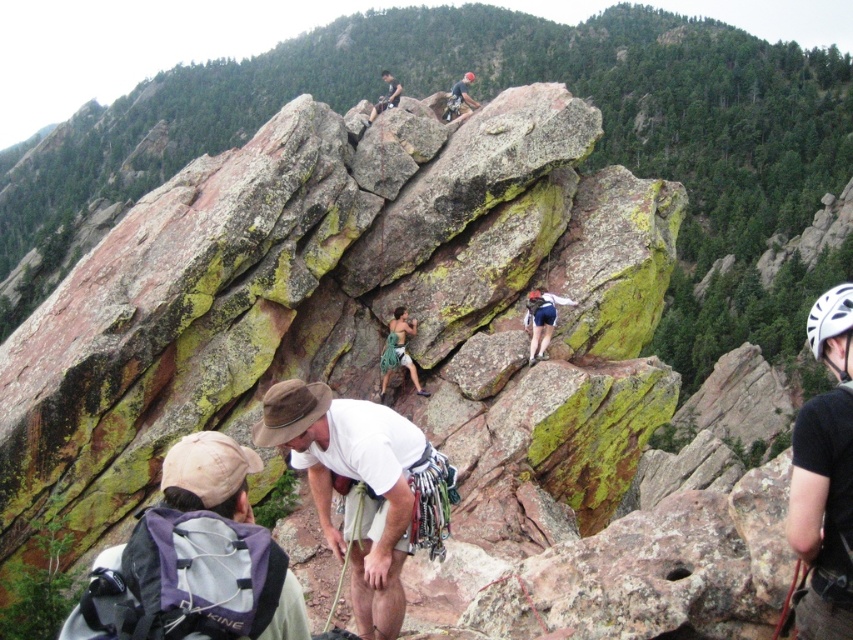
Question: Which object is the closest to the white cotton shirt at center?

Choices:
 (A) matte black helmet at upper center
 (B) black mesh helmet at upper right

Answer: (B)

Question: Is black mesh helmet at upper right in front of matte black helmet at upper center?

Choices:
 (A) yes
 (B) no

Answer: (A)

Question: Which object appears closest to the camera in this image?

Choices:
 (A) matte black helmet at upper center
 (B) white cotton shirt at center

Answer: (B)

Question: Which object is positioned farthest from the white cotton shirt at center?

Choices:
 (A) matte black helmet at upper center
 (B) white matte helmet at upper right

Answer: (A)

Question: Is gray fabric backpack at lower left closer to camera compared to white matte helmet at upper right?

Choices:
 (A) yes
 (B) no

Answer: (A)

Question: Can you confirm if white cotton shirt at center is bigger than matte black helmet at upper center?

Choices:
 (A) yes
 (B) no

Answer: (B)